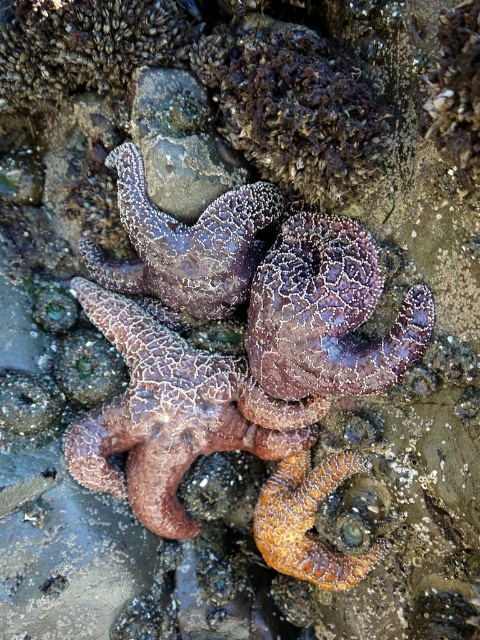
Question: Is rusty textured starfish at center in front of purple rough starfish at center?

Choices:
 (A) yes
 (B) no

Answer: (A)

Question: Which of these objects is positioned farthest from the rusty textured starfish at center?

Choices:
 (A) orange textured starfish at center
 (B) textured purple starfish at center

Answer: (A)

Question: Can you confirm if textured purple starfish at center is smaller than orange textured starfish at center?

Choices:
 (A) no
 (B) yes

Answer: (A)

Question: Which is farther from the orange textured starfish at center?

Choices:
 (A) purple rough starfish at center
 (B) rusty textured starfish at center

Answer: (A)

Question: Is textured purple starfish at center to the right of purple rough starfish at center from the viewer's perspective?

Choices:
 (A) yes
 (B) no

Answer: (A)

Question: Among these points, which one is nearest to the camera?

Choices:
 (A) (384, 362)
 (B) (173, 516)
 (C) (289, 481)
 (D) (157, 275)

Answer: (A)